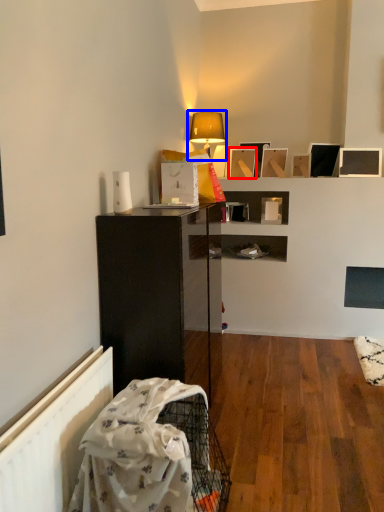
Question: Which object is further to the camera taking this photo, picture frame (highlighted by a red box) or lamp (highlighted by a blue box)?

Choices:
 (A) picture frame
 (B) lamp

Answer: (A)